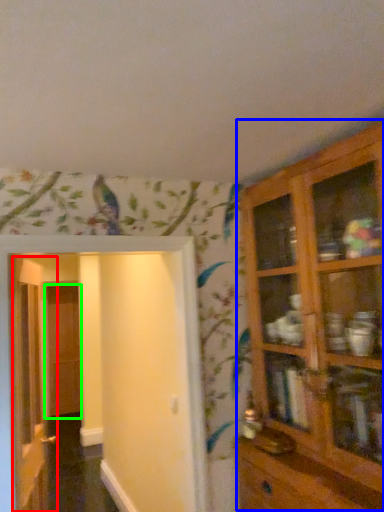
Question: Estimate the real-world distances between objects in this image. Which object is farther from door (highlighted by a red box), cupboard (highlighted by a blue box) or door (highlighted by a green box)?

Choices:
 (A) cupboard
 (B) door

Answer: (B)